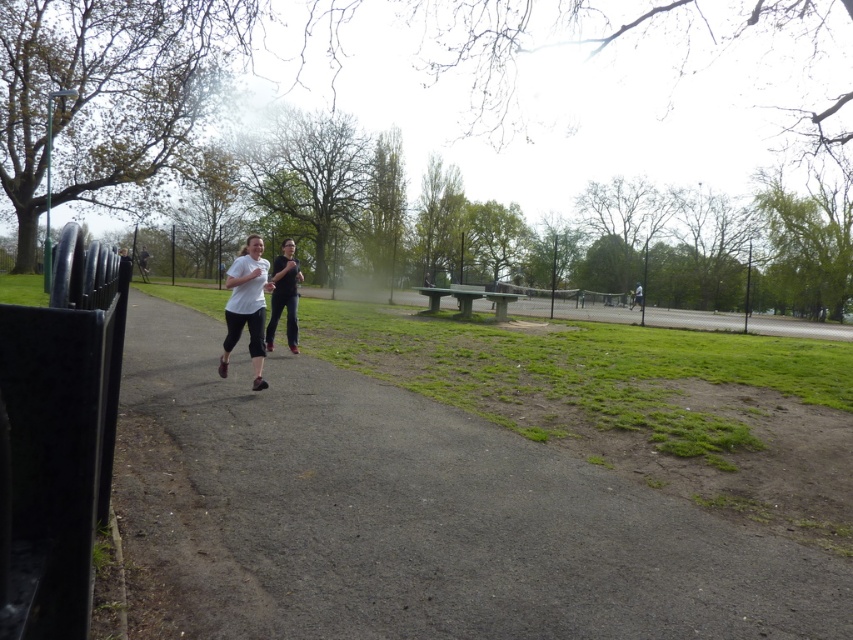
Does white matte t-shirt at center have a greater height compared to black matte pants at center?

Correct, white matte t-shirt at center is much taller as black matte pants at center.

Does white matte t-shirt at center come behind black matte pants at center?

That is False.

Who is more distant from viewer, (254, 314) or (297, 294)?

The point (297, 294) is behind.

The image size is (853, 640). I want to click on white matte t-shirt at center, so click(247, 307).

Does gray asphalt path at center have a greater width compared to black matte pants at center?

Yes.

Does gray asphalt path at center appear over black matte pants at center?

No, gray asphalt path at center is not above black matte pants at center.

Find the location of a particular element. gray asphalt path at center is located at coordinates point(410,516).

At what (x,y) coordinates should I click in order to perform the action: click on gray asphalt path at center. Please return your answer as a coordinate pair (x, y). This screenshot has width=853, height=640. Looking at the image, I should click on (410, 516).

Can you confirm if gray asphalt path at center is positioned below white matte t-shirt at center?

Correct, gray asphalt path at center is located below white matte t-shirt at center.

Which is in front, point (450, 620) or point (259, 305)?

Positioned in front is point (450, 620).

Where is `gray asphalt path at center`? This screenshot has width=853, height=640. gray asphalt path at center is located at coordinates (410, 516).